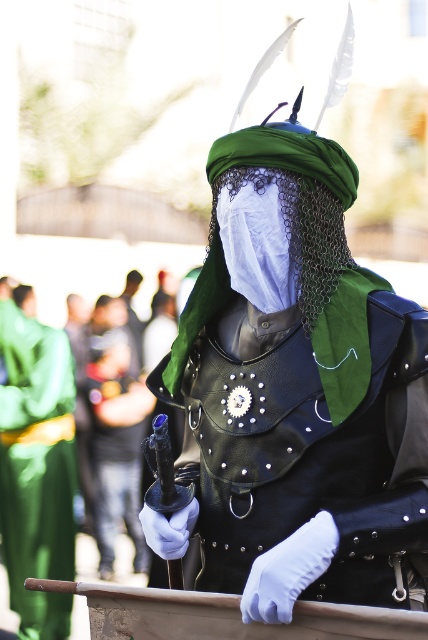
You are a character in a fantasy game and need to identify the armor piece located at the center of your screen. According to the scene, what is the armor piece at point (296, 385)?

The armor piece at point (296, 385) is leather armor at center.

You are a costume designer preparing for a play. You need to ensure the leather armor at center and the green leather robe at left are arranged correctly on the stage. According to the scene description, which item should be placed higher up?

The leather armor at center should be placed higher up because it is described as being above the green leather robe at left.